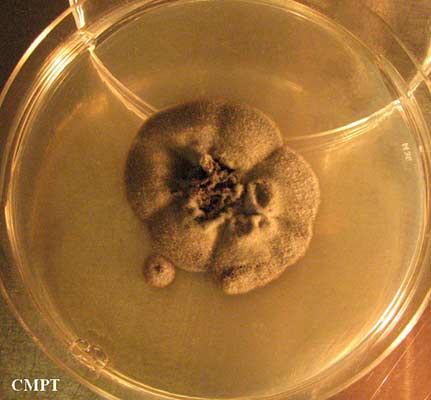
The image size is (431, 400). In order to click on bowl in this screenshot , I will do `click(36, 64)`.